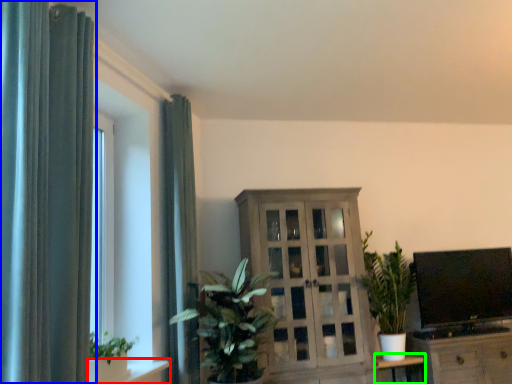
Question: Which object is positioned farthest from shelf (highlighted by a red box)? Select from curtain (highlighted by a blue box) and table (highlighted by a green box).

Choices:
 (A) curtain
 (B) table

Answer: (B)